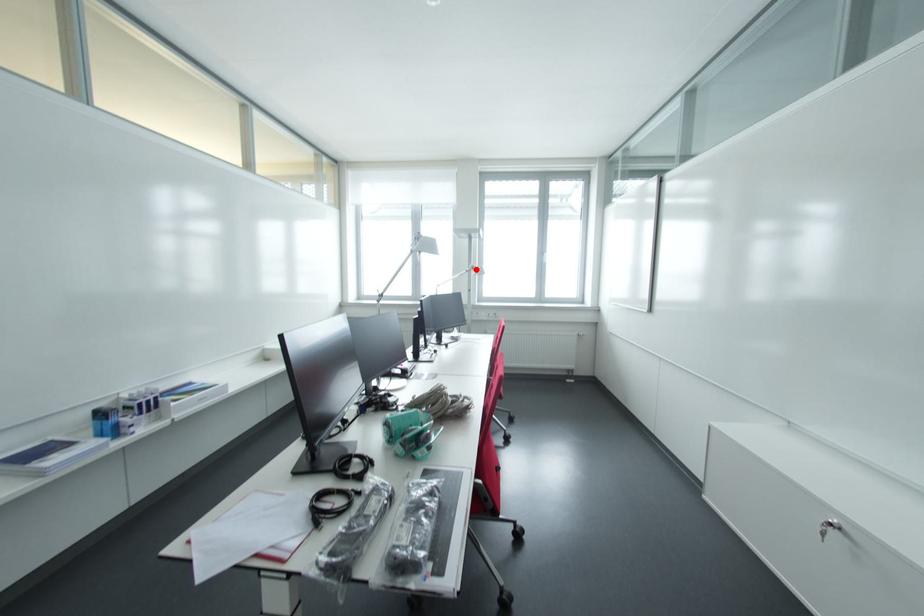
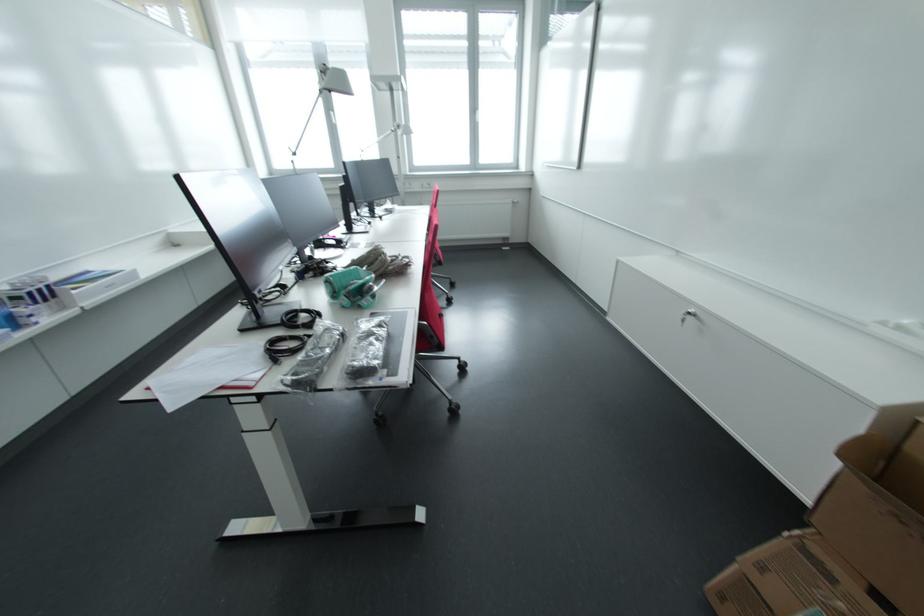
Question: I am providing you with two images of the same scene from different viewpoints. In image1, a red point is highlighted. Considering the same 3D point in image2, which of the following is correct?

Choices:
 (A) It is closer
 (B) It is farther

Answer: (A)